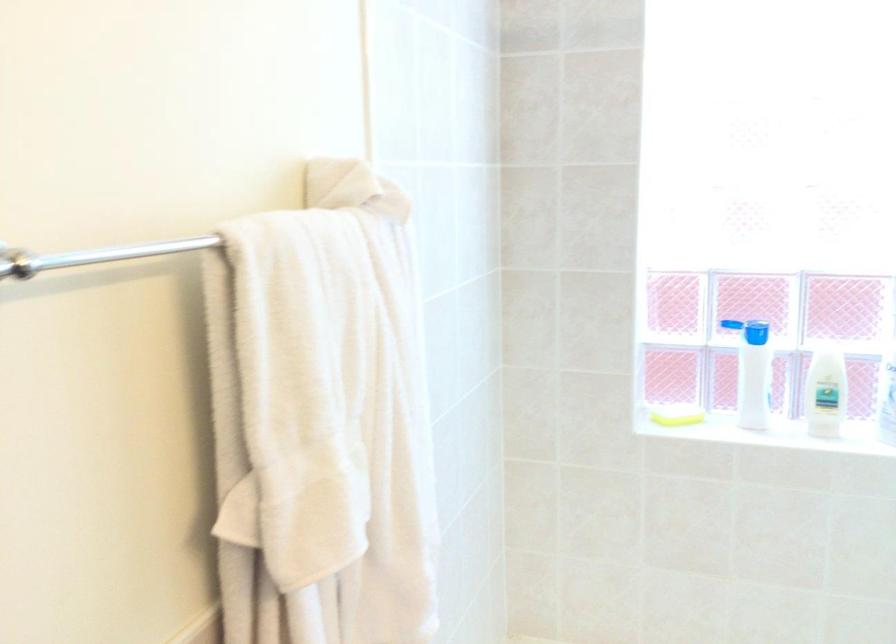
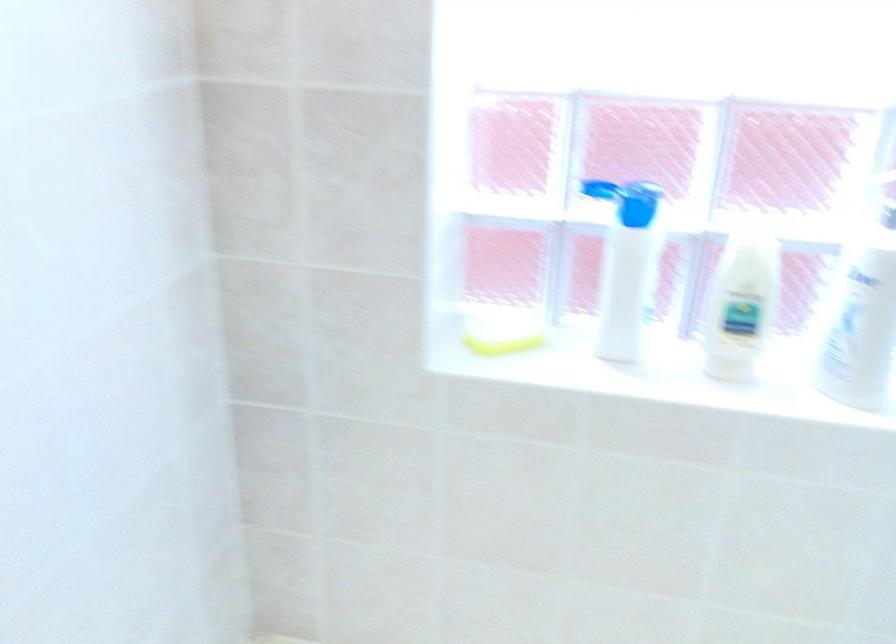
Where in the second image is the point corresponding to point 755,366 from the first image?

(625, 266)